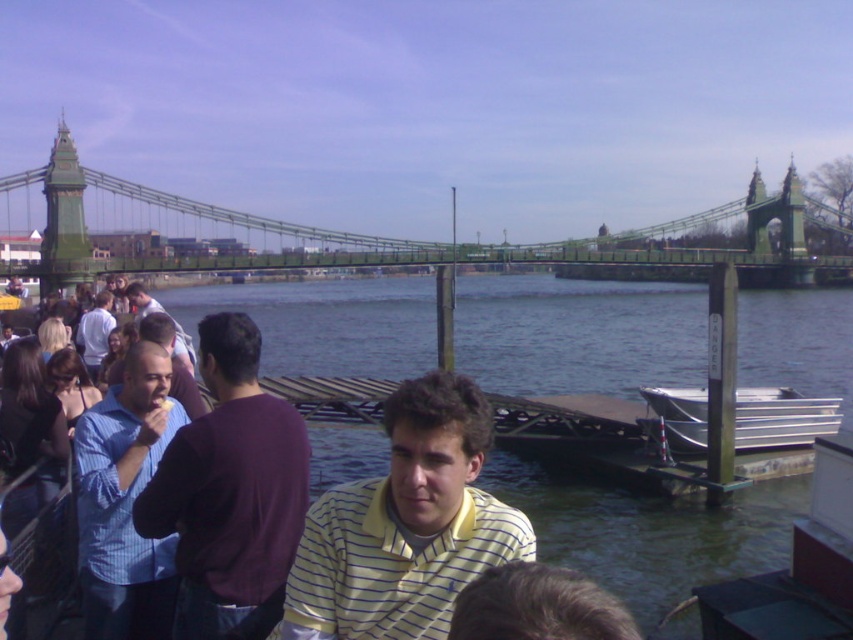
Does point (207, 493) lie behind point (695, 448)?

No.

Is purple sweater at left bigger than metallic silver boat at lower right?

Indeed, purple sweater at left has a larger size compared to metallic silver boat at lower right.

Between point (215, 420) and point (679, 392), which one is positioned in front?

Point (215, 420) is more forward.

Image resolution: width=853 pixels, height=640 pixels. I want to click on purple sweater at left, so click(230, 492).

Does yellow striped shirt at center have a greater height compared to blue striped shirt at left?

Incorrect, yellow striped shirt at center's height is not larger of blue striped shirt at left's.

The image size is (853, 640). Describe the element at coordinates (405, 525) in the screenshot. I see `yellow striped shirt at center` at that location.

The image size is (853, 640). Identify the location of yellow striped shirt at center. (405, 525).

Can you confirm if purple sweater at left is smaller than dark brown hair at lower center?

Indeed, purple sweater at left has a smaller size compared to dark brown hair at lower center.

Is point (209, 604) less distant than point (490, 605)?

No, (209, 604) is further to viewer.

Identify the location of purple sweater at left. (230, 492).